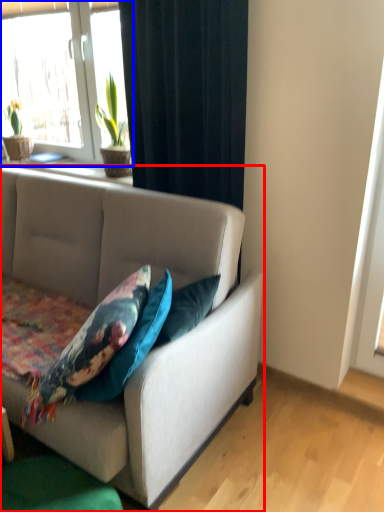
Question: Which of the following is the farthest to the observer, studio couch (highlighted by a red box) or window (highlighted by a blue box)?

Choices:
 (A) studio couch
 (B) window

Answer: (B)